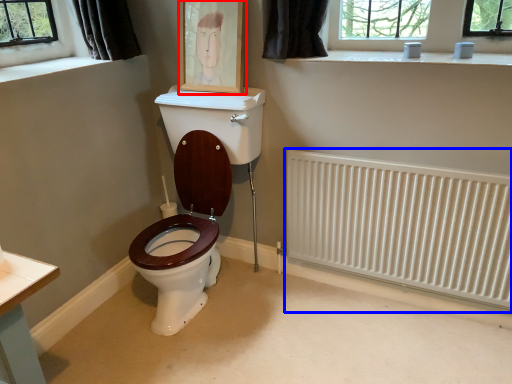
Question: Which point is further to the camera, picture frame (highlighted by a red box) or radiator (highlighted by a blue box)?

Choices:
 (A) picture frame
 (B) radiator

Answer: (A)